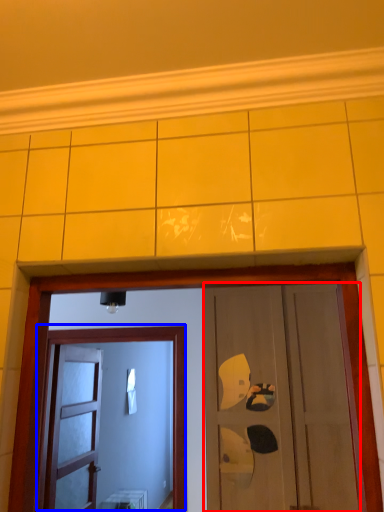
Question: Which point is further to the camera, door (highlighted by a red box) or door (highlighted by a blue box)?

Choices:
 (A) door
 (B) door

Answer: (B)